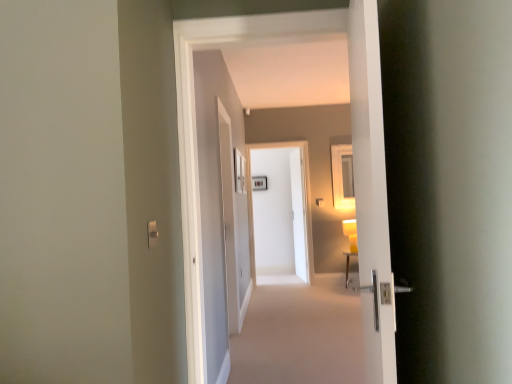
In order to click on white glossy door at center, which is counted as the first door, starting from the front in this screenshot , I will do [371, 193].

Find the location of a particular element. This screenshot has width=512, height=384. satin silver switch at lower left is located at coordinates (152, 234).

The height and width of the screenshot is (384, 512). I want to click on white glossy door handle at right, so click(x=300, y=335).

Find the location of a particular element. yellow matte lamp at right is located at coordinates (351, 233).

Is white glossy screen door at center further to camera compared to white glossy door at center, which appears as the second door when viewed from the front?

Yes, the depth of white glossy screen door at center is greater than that of white glossy door at center, which appears as the second door when viewed from the front.

Which of these two, white glossy screen door at center or white glossy door at center, which appears as the second door when viewed from the front, is wider?

Wider between the two is white glossy screen door at center.

Is point (297, 182) less distant than point (288, 241)?

Yes, it is.

Could you tell me if white glossy screen door at center is facing white glossy door at center, which is counted as the first door, starting from the front?

No, white glossy screen door at center does not turn towards white glossy door at center, which is counted as the first door, starting from the front.

Between point (297, 217) and point (377, 114), which one is positioned behind?

The point (297, 217) is more distant.

In order to click on door that is above the white glossy screen door at center (from the image's perspective) in this screenshot , I will do `click(371, 193)`.

Is the depth of white glossy screen door at center greater than that of white glossy door at center, which is counted as the first door, starting from the front?

Result: Yes, white glossy screen door at center is further from the camera.

Can you tell me how much white glossy door handle at right and white glossy door at center, which is the 2th door from back to front, differ in facing direction?

They differ by 94.9 degrees in their facing directions.

Is white glossy door handle at right facing away from white glossy door at center, which is counted as the first door, starting from the front?

No.

From a real-world perspective, is white glossy door handle at right positioned under white glossy door at center, which is the 2th door from back to front, based on gravity?

Indeed, from a real-world perspective, white glossy door handle at right is positioned beneath white glossy door at center, which is the 2th door from back to front.

Does point (273, 367) come closer to viewer compared to point (387, 211)?

That is False.

Which is in front, satin silver switch at lower left or white glossy door at center, which is the 2th door from back to front?

white glossy door at center, which is the 2th door from back to front, is closer to the camera.

Considering the sizes of objects satin silver switch at lower left and white glossy door at center, which is counted as the first door, starting from the front, in the image provided, who is taller, satin silver switch at lower left or white glossy door at center, which is counted as the first door, starting from the front,?

white glossy door at center, which is counted as the first door, starting from the front, is taller.

Is satin silver switch at lower left wider than white glossy door at center, which is the 2th door from back to front?

No, satin silver switch at lower left is not wider than white glossy door at center, which is the 2th door from back to front.

Can you confirm if white glossy screen door at center is thinner than yellow matte lamp at right?

Yes.

Between point (302, 238) and point (350, 246), which one is positioned in front?

Point (350, 246)

Which is behind, white glossy screen door at center or yellow matte lamp at right?

white glossy screen door at center is further away from the camera.

Is white glossy door at center, which appears as the second door when viewed from the front, wider than yellow matte lamp at right?

No, white glossy door at center, which appears as the second door when viewed from the front, is not wider than yellow matte lamp at right.

Based on their sizes in the image, would you say white glossy door at center, which appears as the second door when viewed from the front, is bigger or smaller than yellow matte lamp at right?

In the image, white glossy door at center, which appears as the second door when viewed from the front, appears to be larger than yellow matte lamp at right.

In the scene shown: Considering the sizes of white glossy door at center, which appears as the second door when viewed from the front, and white glossy door at center, which is counted as the first door, starting from the front, in the image, is white glossy door at center, which appears as the second door when viewed from the front, wider or thinner than white glossy door at center, which is counted as the first door, starting from the front,?

Clearly, white glossy door at center, which appears as the second door when viewed from the front, has less width compared to white glossy door at center, which is counted as the first door, starting from the front.

Which is closer, (292, 152) or (361, 184)?

Clearly, point (292, 152) is more distant from the camera than point (361, 184).

From a real-world perspective, is white glossy door at center, the first door viewed from the back, on white glossy door at center, which is the 2th door from back to front?

No.

Considering the relative positions of white glossy door at center, which appears as the second door when viewed from the front, and white glossy door at center, which is counted as the first door, starting from the front, in the image provided, is white glossy door at center, which appears as the second door when viewed from the front, to the left or to the right of white glossy door at center, which is counted as the first door, starting from the front,?

From the image, it's evident that white glossy door at center, which appears as the second door when viewed from the front, is to the left of white glossy door at center, which is counted as the first door, starting from the front.

The height and width of the screenshot is (384, 512). Find the location of `door that is the 1st one when counting forward from the white glossy screen door at center`. door that is the 1st one when counting forward from the white glossy screen door at center is located at coordinates (x=279, y=213).

The image size is (512, 384). What are the coordinates of `screen door lying behind the white glossy door at center, which is the 2th door from back to front` in the screenshot? It's located at (298, 215).

Which object lies further to the anchor point white glossy door at center, which is the 2th door from back to front, white glossy door at center, which appears as the second door when viewed from the front, or white glossy screen door at center?

white glossy screen door at center.

Based on their spatial positions, is white glossy door at center, which appears as the second door when viewed from the front, or satin silver switch at lower left further from white glossy door handle at right?

Based on the image, satin silver switch at lower left appears to be further to white glossy door handle at right.

Considering their positions, is white glossy door at center, which appears as the second door when viewed from the front, positioned further to white glossy door at center, which is counted as the first door, starting from the front, than satin silver switch at lower left?

white glossy door at center, which appears as the second door when viewed from the front, is positioned further to the anchor white glossy door at center, which is counted as the first door, starting from the front.

Which object lies nearer to the anchor point satin silver switch at lower left, yellow matte lamp at right or white glossy door at center, the first door viewed from the back?

The object closer to satin silver switch at lower left is yellow matte lamp at right.

Looking at the image, which one is located closer to white glossy door handle at right, white glossy door at center, the first door viewed from the back, or white glossy screen door at center?

white glossy door at center, the first door viewed from the back, is positioned closer to the anchor white glossy door handle at right.

Looking at the image, which one is located closer to white glossy door handle at right, white glossy door at center, which is counted as the first door, starting from the front, or satin silver switch at lower left?

The object closer to white glossy door handle at right is white glossy door at center, which is counted as the first door, starting from the front.

Estimate the real-world distances between objects in this image. Which object is closer to satin silver switch at lower left, white glossy screen door at center or yellow matte lamp at right?

Based on the image, yellow matte lamp at right appears to be nearer to satin silver switch at lower left.

Estimate the real-world distances between objects in this image. Which object is closer to white glossy door at center, the first door viewed from the back, white glossy door at center, which is counted as the first door, starting from the front, or yellow matte lamp at right?

Based on the image, yellow matte lamp at right appears to be nearer to white glossy door at center, the first door viewed from the back.

Find the location of `plain between white glossy door at center, which is counted as the first door, starting from the front, and white glossy door at center, which appears as the second door when viewed from the front, along the z-axis`. plain between white glossy door at center, which is counted as the first door, starting from the front, and white glossy door at center, which appears as the second door when viewed from the front, along the z-axis is located at coordinates (300, 335).

This screenshot has width=512, height=384. I want to click on light switch between white glossy door at center, which is the 2th door from back to front, and white glossy door at center, the first door viewed from the back, in the front-back direction, so click(152, 234).

In order to click on door between white glossy door handle at right and white glossy screen door at center in the front-back direction in this screenshot , I will do `click(279, 213)`.

Where is `door between satin silver switch at lower left and white glossy screen door at center along the z-axis`? door between satin silver switch at lower left and white glossy screen door at center along the z-axis is located at coordinates (279, 213).